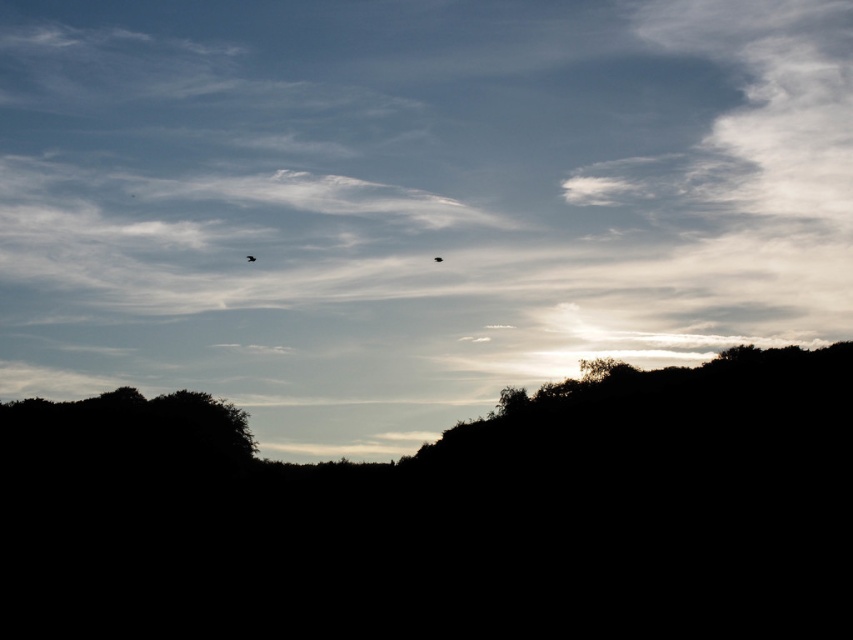
Is point (570, 157) in front of point (252, 260)?

That is False.

Is white fluffy cloud at upper center below matte black bird at upper center?

No.

Where is `white fluffy cloud at upper center`? white fluffy cloud at upper center is located at coordinates (412, 198).

Can you confirm if white fluffy cloud at upper center is positioned below black silhouetted hillside at center?

Incorrect, white fluffy cloud at upper center is not positioned below black silhouetted hillside at center.

Does point (33, 227) come behind point (730, 634)?

Yes, point (33, 227) is behind point (730, 634).

Who is more forward, (57, 342) or (642, 609)?

Point (642, 609) is more forward.

Locate an element on the screen. This screenshot has height=640, width=853. white fluffy cloud at upper center is located at coordinates (412, 198).

Is black silhouetted hillside at center to the right of matte black bird at upper center from the viewer's perspective?

Indeed, black silhouetted hillside at center is positioned on the right side of matte black bird at upper center.

Can you confirm if black silhouetted hillside at center is positioned below matte black bird at upper center?

Correct, black silhouetted hillside at center is located below matte black bird at upper center.

Locate an element on the screen. black silhouetted hillside at center is located at coordinates tap(445, 516).